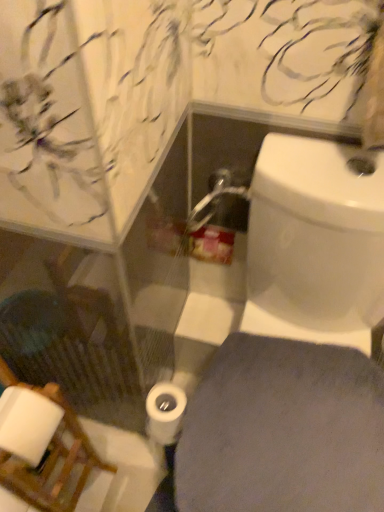
Describe the element at coordinates (42, 449) in the screenshot. The height and width of the screenshot is (512, 384). I see `wooden chair at lower left` at that location.

What are the coordinates of `white matte toilet paper at center` in the screenshot? It's located at (x=165, y=413).

Does wooden chair at lower left appear on the right side of white matte toilet paper at center?

In fact, wooden chair at lower left is to the left of white matte toilet paper at center.

Is wooden chair at lower left spatially inside white matte toilet paper at center, or outside of it?

wooden chair at lower left is outside white matte toilet paper at center.

Who is bigger, wooden chair at lower left or white matte toilet paper at center?

Bigger between the two is wooden chair at lower left.

Which object is further away from the camera, wooden chair at lower left or white matte toilet paper at center?

white matte toilet paper at center is further away from the camera.

From a real-world perspective, is wooden chair at lower left located beneath white glossy toilet at lower right?

Yes, from a real-world perspective, wooden chair at lower left is under white glossy toilet at lower right.

Does wooden chair at lower left contain white glossy toilet at lower right?

No, white glossy toilet at lower right is located outside of wooden chair at lower left.

Which object is positioned more to the right, wooden chair at lower left or white glossy toilet at lower right?

white glossy toilet at lower right.

Could you tell me if wooden chair at lower left is facing white glossy toilet at lower right?

Yes, wooden chair at lower left faces towards white glossy toilet at lower right.

How far apart are white matte toilet paper at center and wooden chair at lower left?

white matte toilet paper at center is 24.54 centimeters from wooden chair at lower left.

Is white matte toilet paper at center wider than wooden chair at lower left?

No.

Considering the sizes of objects white matte toilet paper at center and wooden chair at lower left in the image provided, who is taller, white matte toilet paper at center or wooden chair at lower left?

With more height is wooden chair at lower left.

From a real-world perspective, is white matte toilet paper at center on wooden chair at lower left?

Yes.

Is white matte toilet paper at center looking in the opposite direction of white glossy toilet at lower right?

No, white matte toilet paper at center is not facing away from white glossy toilet at lower right.

From a real-world perspective, is white matte toilet paper at center on white glossy toilet at lower right?

No, from a real-world perspective, white matte toilet paper at center is not over white glossy toilet at lower right

From the image's perspective, which object appears higher, white matte toilet paper at center or white glossy toilet at lower right?

white glossy toilet at lower right.

Between white matte toilet paper at center and white glossy toilet at lower right, which one has smaller width?

white matte toilet paper at center.

Locate an element on the screen. The height and width of the screenshot is (512, 384). toilet paper that is behind the white glossy toilet at lower right is located at coordinates (165, 413).

How much distance is there between white glossy toilet at lower right and white matte toilet paper at center?

A distance of 8.15 inches exists between white glossy toilet at lower right and white matte toilet paper at center.

Who is bigger, white glossy toilet at lower right or white matte toilet paper at center?

white glossy toilet at lower right is bigger.

Is white glossy toilet at lower right facing towards wooden chair at lower left?

No.

From the image's perspective, is white glossy toilet at lower right under wooden chair at lower left?

Actually, white glossy toilet at lower right appears above wooden chair at lower left in the image.

Locate an element on the screen. The image size is (384, 512). chair that appears below the white matte toilet paper at center (from the image's perspective) is located at coordinates (42, 449).

Locate an element on the screen. The width and height of the screenshot is (384, 512). chair that is in front of the white glossy toilet at lower right is located at coordinates (42, 449).

When comparing their distances from white matte toilet paper at center, does wooden chair at lower left or white glossy toilet at lower right seem further?

wooden chair at lower left.

When comparing their distances from white matte toilet paper at center, does white glossy toilet at lower right or wooden chair at lower left seem closer?

white glossy toilet at lower right.

Estimate the real-world distances between objects in this image. Which object is closer to wooden chair at lower left, white glossy toilet at lower right or white matte toilet paper at center?

The object closer to wooden chair at lower left is white matte toilet paper at center.

Estimate the real-world distances between objects in this image. Which object is closer to wooden chair at lower left, white matte toilet paper at center or white glossy toilet at lower right?

Among the two, white matte toilet paper at center is located nearer to wooden chair at lower left.

Considering their positions, is white matte toilet paper at center positioned further to white glossy toilet at lower right than wooden chair at lower left?

Based on the image, wooden chair at lower left appears to be further to white glossy toilet at lower right.

Considering their positions, is wooden chair at lower left positioned closer to white glossy toilet at lower right than white matte toilet paper at center?

Among the two, white matte toilet paper at center is located nearer to white glossy toilet at lower right.

The image size is (384, 512). What are the coordinates of `toilet paper between wooden chair at lower left and white glossy toilet at lower right` in the screenshot? It's located at (165, 413).